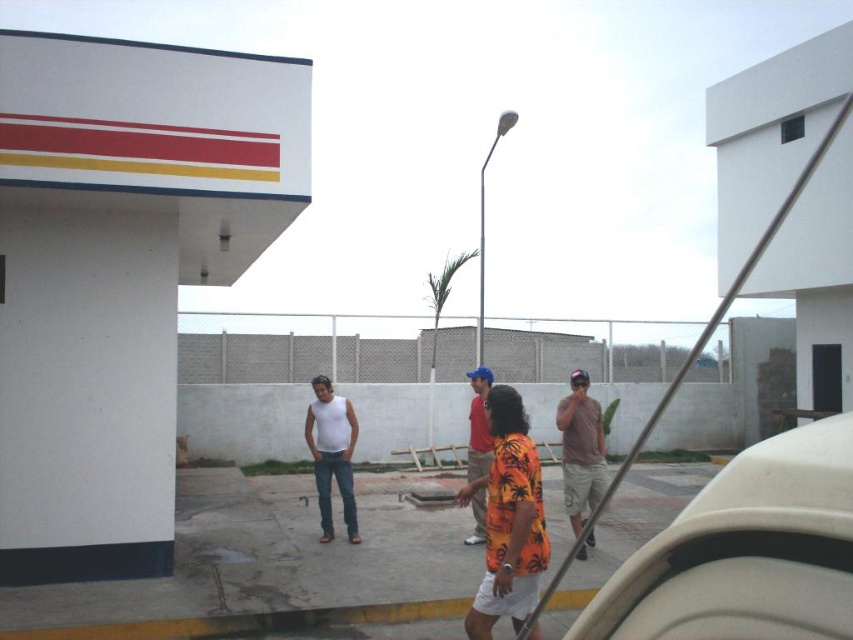
You are a photographer setting up a tripod to take a group photo of the people at the gas station. You notice two shirts in the scene, the brown cotton shirt at center and the orange printed shirt at center. Which shirt should you adjust in your composition to ensure both are visible in the frame?

The brown cotton shirt at center is shorter than the orange printed shirt at center. To ensure both are visible, adjust the angle or position so the shorter brown cotton shirt at center isn not blocked by the taller orange printed shirt at center.

You are a delivery person trying to place a small package on top of the white plastic car at right. Considering the orange printed shirt at center is currently in the way, can you place the package there without moving the shirt?

The white plastic car at right is not as tall as the orange printed shirt at center, so the shirt is blocking the top of the car. You will need to move the orange printed shirt at center to place the package on the white plastic car at right.

You are a delivery person who needs to place a small package on the white plastic car at right. However, there is an orange printed shirt at center nearby. Which object is smaller and can fit the package?

The white plastic car at right is smaller than the orange printed shirt at center, so the package should be placed on the white plastic car at right.